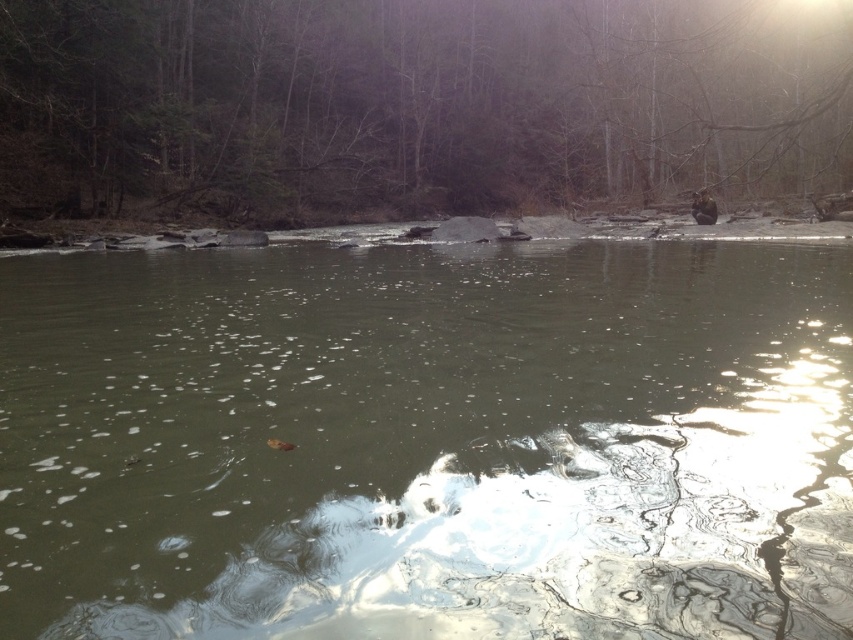
Question: Among these points, which one is farthest from the camera?

Choices:
 (A) (820, 122)
 (B) (816, 497)

Answer: (A)

Question: Is greenish murky water at center in front of brown wood tree at center?

Choices:
 (A) yes
 (B) no

Answer: (A)

Question: Can you confirm if greenish murky water at center is bigger than brown wood tree at center?

Choices:
 (A) no
 (B) yes

Answer: (A)

Question: Which point is farther from the camera taking this photo?

Choices:
 (A) (717, 296)
 (B) (485, 106)

Answer: (B)

Question: Observing the image, what is the correct spatial positioning of greenish murky water at center in reference to brown wood tree at center?

Choices:
 (A) above
 (B) below

Answer: (B)